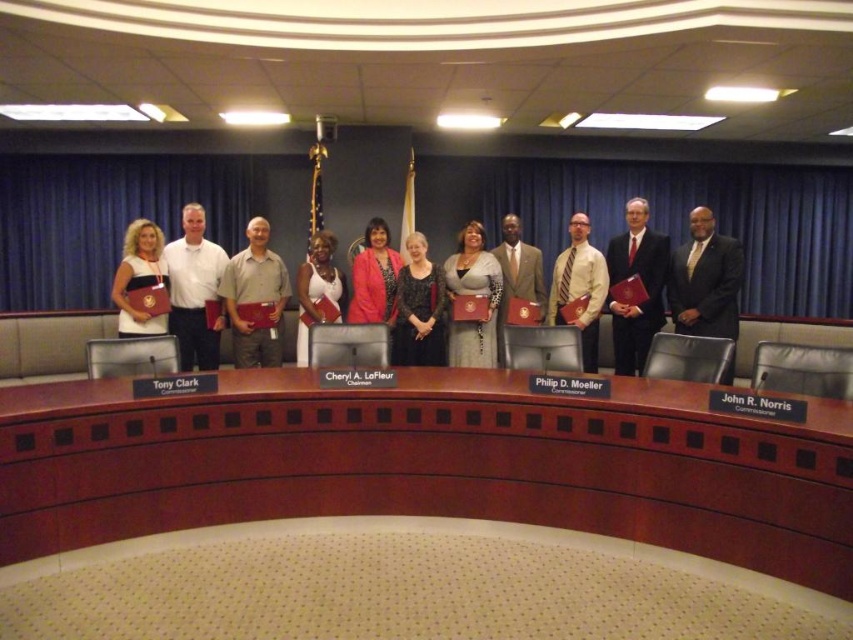
In the formal group photo, you notice a black suit at center and a white striped tie at center. Which clothing item is covering the other one?

The black suit at center is positioned over the white striped tie at center, meaning the suit is covering the tie.

In the formal group photo, you notice two individuals wearing a black suit at center and a white shirt at left. Which person is wearing a wider garment?

The black suit at center is wider than the white shirt at left.

You are a photographer standing at the camera position. You want to place a small decorative item on the brown wood table at center. The item requires a space of 1 foot in depth from the front edge of the table. Is there enough space available on the table for this item?

The brown wood table at center is 8.18 feet from the camera, but the question of space depth on the table isn not addressed in the Objects Description. Therefore, I cannot determine if there is enough space for the item based on the provided information.